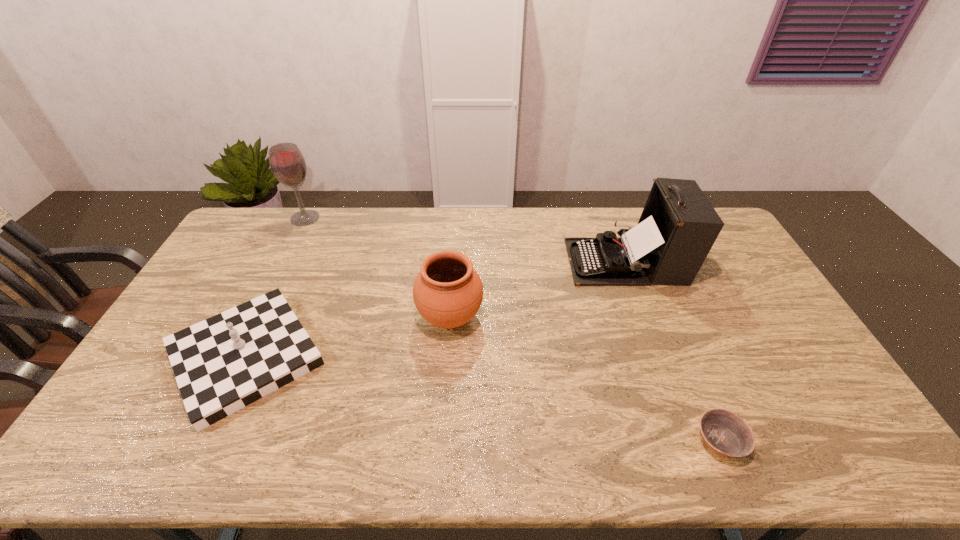
Find the location of a particular element. The image size is (960, 540). free space at the near edge of the desktop is located at coordinates (431, 465).

In the image, there is a desktop. Find the location of `vacant area at the left edge`. vacant area at the left edge is located at coordinates (238, 285).

This screenshot has width=960, height=540. In the image, there is a desktop. Find the location of `vacant space at the right edge`. vacant space at the right edge is located at coordinates (756, 358).

In the image, there is a desktop. Identify the location of vacant space at the near left corner. (124, 462).

The width and height of the screenshot is (960, 540). I want to click on free point between the second shortest object and the third object from right to left, so click(x=348, y=337).

Find the location of a particular element. free space between the third object from right to left and the second shortest object is located at coordinates (348, 337).

The height and width of the screenshot is (540, 960). I want to click on unoccupied position between the farthest object and the shortest object, so point(513,329).

What are the coordinates of `free space between the second shortest object and the alcohol` in the screenshot? It's located at (276, 287).

This screenshot has width=960, height=540. Find the location of `free space that is in between the typewriter and the third object from left to right`. free space that is in between the typewriter and the third object from left to right is located at coordinates (538, 289).

You are a GUI agent. You are given a task and a screenshot of the screen. Output one action in this format:
    pyautogui.click(x=<x>, y=<y>)
    Task: Click on the vacant area between the pottery and the alcohol
    
    Given the screenshot: What is the action you would take?
    pyautogui.click(x=377, y=268)